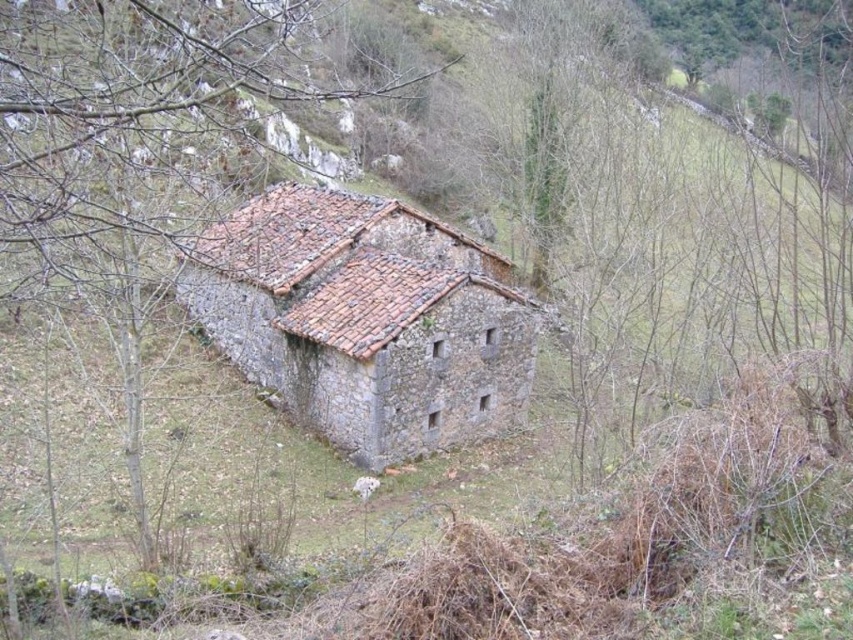
Is brown bark tree at center positioned in front of rustic stone barn at center?

Yes, it is in front of rustic stone barn at center.

Can you confirm if brown bark tree at center is wider than rustic stone barn at center?

Correct, the width of brown bark tree at center exceeds that of rustic stone barn at center.

Find the location of `brown bark tree at center`. brown bark tree at center is located at coordinates (131, 144).